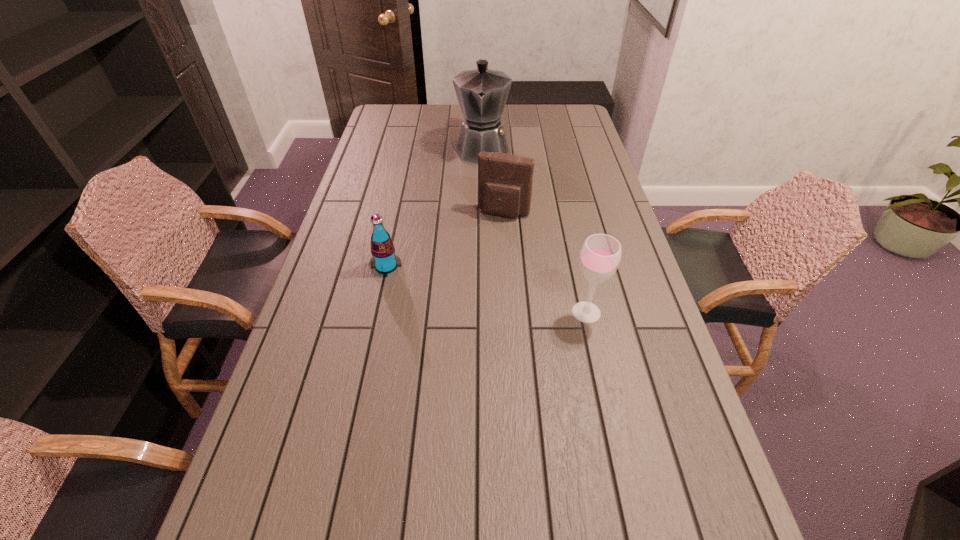
Identify the location of vacant space at the right edge. This screenshot has width=960, height=540. (648, 299).

Image resolution: width=960 pixels, height=540 pixels. Identify the location of vacant area at the far left corner. pos(386,110).

Find the location of a particular element. This screenshot has width=960, height=540. free space at the near left corner of the desktop is located at coordinates (302, 487).

The height and width of the screenshot is (540, 960). In the image, there is a desktop. Identify the location of vacant space at the far right corner. (551, 111).

The image size is (960, 540). In order to click on free spot between the farthest object and the rightmost object in this screenshot , I will do `click(534, 230)`.

Find the location of a particular element. The image size is (960, 540). free area in between the rightmost object and the second farthest object is located at coordinates pos(545,262).

The image size is (960, 540). I want to click on empty location between the coffeepot and the leftmost object, so click(434, 207).

Find the location of `empty location between the shortest object and the wineglass`. empty location between the shortest object and the wineglass is located at coordinates (487, 289).

Locate an element on the screen. vacant space in between the second farthest object and the nearest object is located at coordinates (545, 262).

I want to click on free area in between the third farthest object and the second farthest object, so click(445, 240).